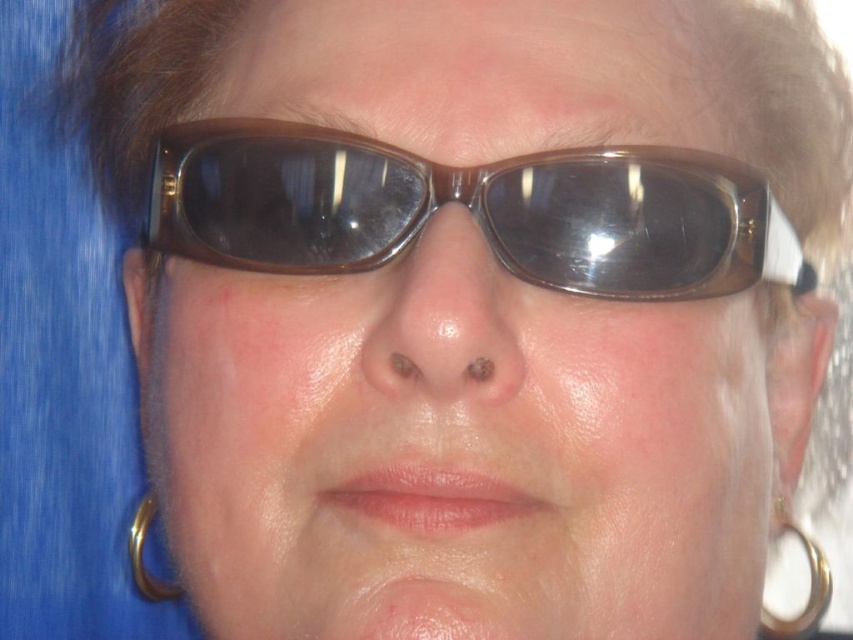
You are a photographer adjusting your camera settings. You notice the matte brown sunglasses at center and the pink matte lips at center in your frame. Which object should you focus on first to ensure clarity, the one closer to the viewer?

The matte brown sunglasses at center is closer to the viewer than the pink matte lips at center, so you should focus on the matte brown sunglasses at center first to ensure clarity.

You are a makeup artist preparing for a photoshoot. You need to place a matte brown sunglasses at center and a pink matte lips at center on the face. Based on the scene description, which object occupies more horizontal space on the face?

The matte brown sunglasses at center might be wider than pink matte lips at center, so the sunglasses likely take up more horizontal space on the face.

You are a makeup artist assessing a client who has the pink matte lips at center and the gold metallic hoop at lower right. Which object is wider when viewed from the front?

The pink matte lips at center might be wider than gold metallic hoop at lower right.